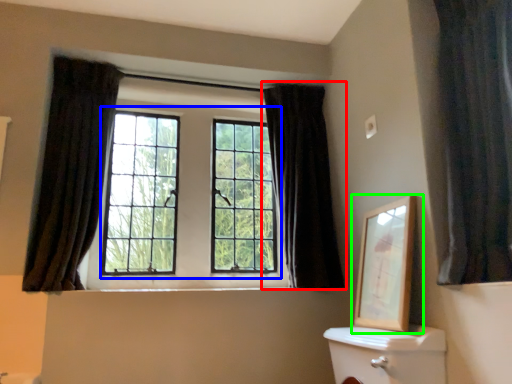
Question: Estimate the real-world distances between objects in this image. Which object is closer to curtain (highlighted by a red box), bay window (highlighted by a blue box) or picture frame (highlighted by a green box)?

Choices:
 (A) bay window
 (B) picture frame

Answer: (A)